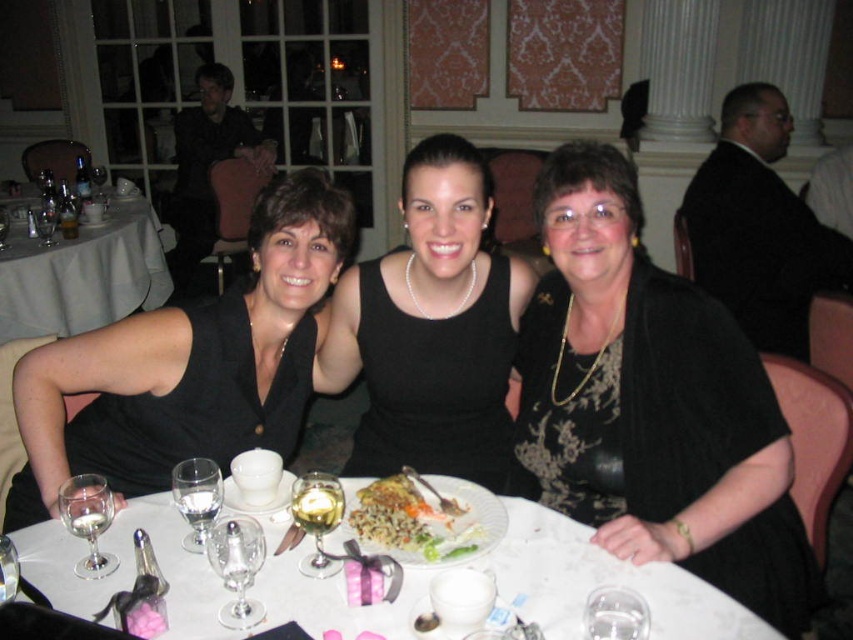
Does clear glass wine glass at lower left have a smaller size compared to transparent glass wine glass at center?

No, clear glass wine glass at lower left is not smaller than transparent glass wine glass at center.

Is clear glass wine glass at lower left bigger than transparent glass wine glass at center?

Correct, clear glass wine glass at lower left is larger in size than transparent glass wine glass at center.

The height and width of the screenshot is (640, 853). What do you see at coordinates (196, 497) in the screenshot?
I see `clear glass wine glass at lower left` at bounding box center [196, 497].

Identify the location of clear glass wine glass at lower left. (196, 497).

Can you confirm if black lace dress at center is smaller than transparent glass wine glass at center?

No, black lace dress at center is not smaller than transparent glass wine glass at center.

What do you see at coordinates (651, 403) in the screenshot? I see `black lace dress at center` at bounding box center [651, 403].

Who is more distant from viewer, [529,321] or [18,563]?

Positioned behind is point [529,321].

Identify the location of black lace dress at center. (651, 403).

Is translucent glass wine glass at center positioned before transparent glass wine glass at table center?

No, it is not.

Where is `translucent glass wine glass at center`? translucent glass wine glass at center is located at coordinates (317, 516).

The width and height of the screenshot is (853, 640). Identify the location of translucent glass wine glass at center. (317, 516).